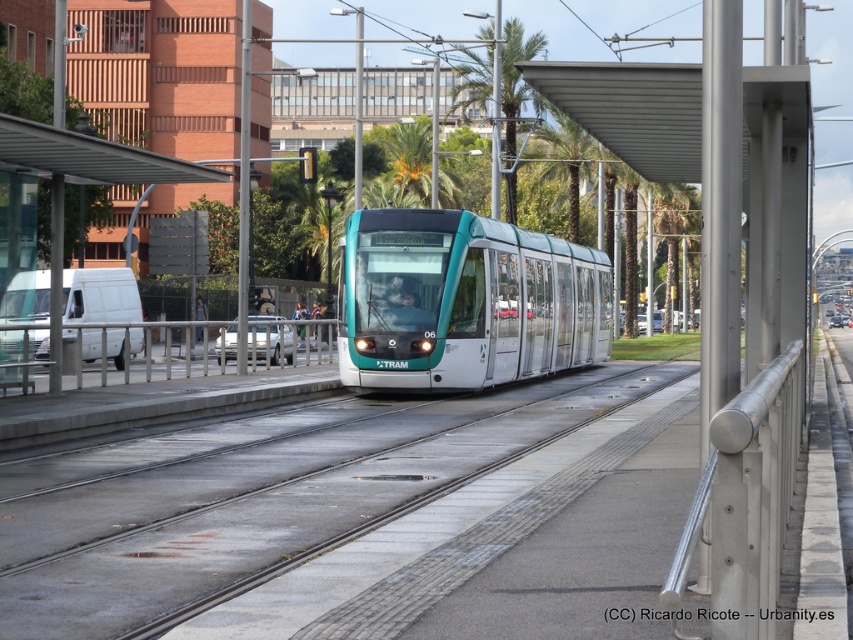
You are a maintenance worker checking the tram station. You need to place a 2.5 meter long inspection tool between the teal glossy tram at center and the metallic silver rail at center. Considering their sizes, will the tool fit between them?

The teal glossy tram at center is larger in size than the metallic silver rail at center. Since the tram is larger, there might not be enough space to fit a 2.5 meter long inspection tool between them. The tool may not fit properly due to the tram taking up more space.

Consider the image. You are a maintenance worker needing to inspect two rails on the tram station platform. The silver metallic rail at right and the metallic silver rail at center are both in need of inspection. Given that your inspection tool has a maximum reach of 25 meters, can you inspect both rails without moving your position?

The distance between the silver metallic rail at right and the metallic silver rail at center is 29.23 meters, which exceeds the tool reach of 25 meters. Therefore, you cannot inspect both rails without moving your position.

You are standing at the tram station and want to board the TRAM 06. The silver metallic rail at right is represented by point (746,500). Where is the silver metallic rail at right located relative to the TRAM 06?

The silver metallic rail at right is located at point (746,500) relative to the TRAM 06.